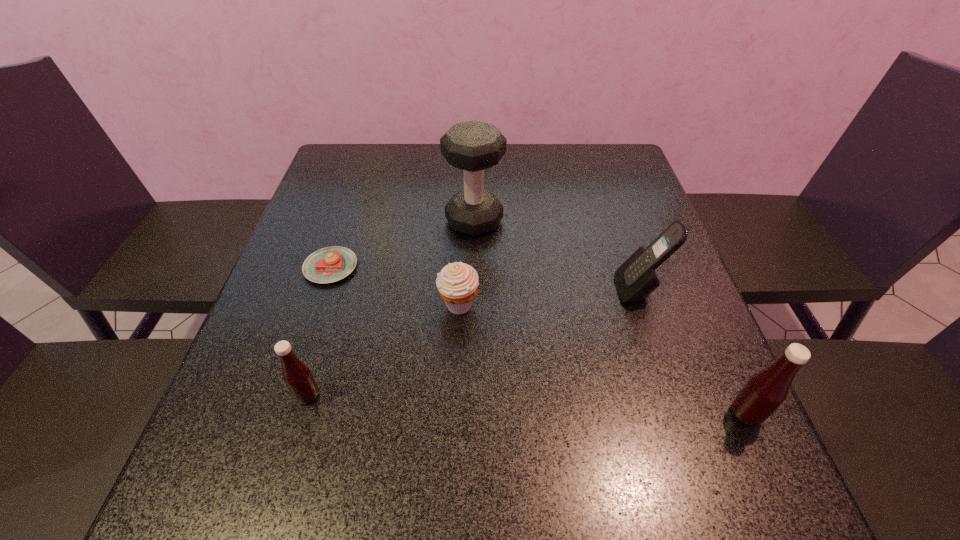
The width and height of the screenshot is (960, 540). I want to click on the left Tabasco sauce, so pos(297,376).

Identify the location of the fourth tallest object. (297, 376).

Find the location of `the rightmost object`. the rightmost object is located at coordinates (766, 390).

The height and width of the screenshot is (540, 960). Find the location of `the taller Tabasco sauce`. the taller Tabasco sauce is located at coordinates (766, 390).

The width and height of the screenshot is (960, 540). Identify the location of pastry. (330, 264).

This screenshot has width=960, height=540. In order to click on dumbbell in this screenshot , I will do `click(472, 146)`.

The image size is (960, 540). Identify the location of the tallest object. (472, 146).

Find the location of a particular element. Image resolution: width=960 pixels, height=540 pixels. the fifth object from left to right is located at coordinates pyautogui.click(x=636, y=278).

In order to click on the fifth tallest object in this screenshot , I will do `click(457, 283)`.

Find the location of a particular element. This screenshot has height=540, width=960. vacant area located 0.180m on the right of the shorter Tabasco sauce is located at coordinates (422, 395).